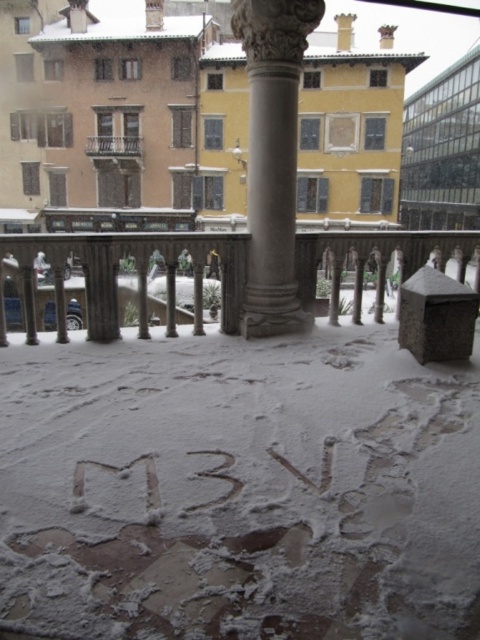
You are standing in the snowy courtyard and want to walk from the smooth gray railing at center to the metallic balcony at upper center. Which object will you pass closer to as you move towards the balcony?

The smooth gray railing at center is larger in size than the metallic balcony at upper center, so you will pass closer to the metallic balcony at upper center as you move towards it.

You are standing in the snowy courtyard and want to walk from the smooth gray railing at center to the polished stone column at center. Which direction should you move to reach the column?

The polished stone column at center is to the right of the smooth gray railing at center, so you should move to your right to reach it.

Based on the photo, you are standing in the snowy courtyard and want to walk from the metallic balcony at upper center to the polished stone column at center. Which direction should you move relative to the balcony?

You should move to the left relative to the metallic balcony at upper center to reach the polished stone column at center, since the polished stone column at center is located to the right of the balcony.